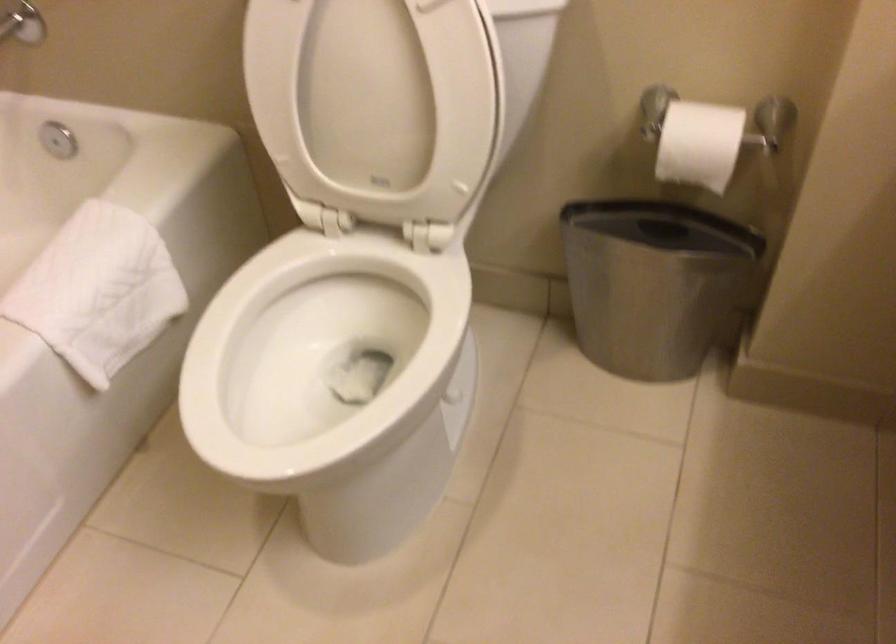
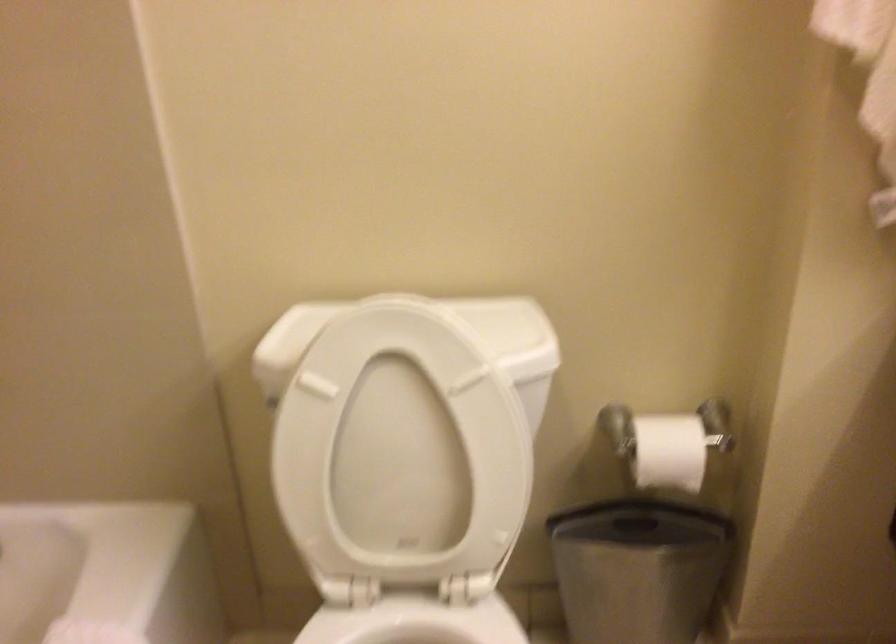
Question: Which direction would the cameraman need to move to produce the second image? Reply with the corresponding letter.

Choices:
 (A) Left
 (B) Right
 (C) Forward
 (D) Backward

Answer: (A)